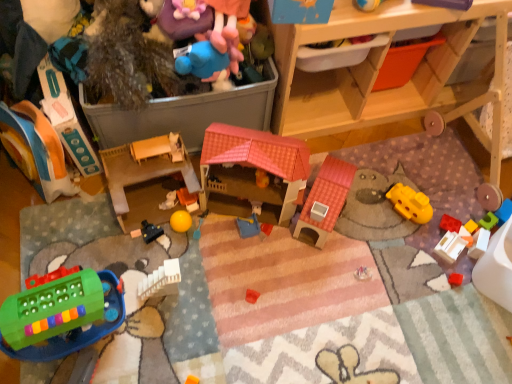
Identify the location of vacant region in front of white matte block at lower right, which is the 12th toy in left-to-right order. This screenshot has width=512, height=384. (467, 298).